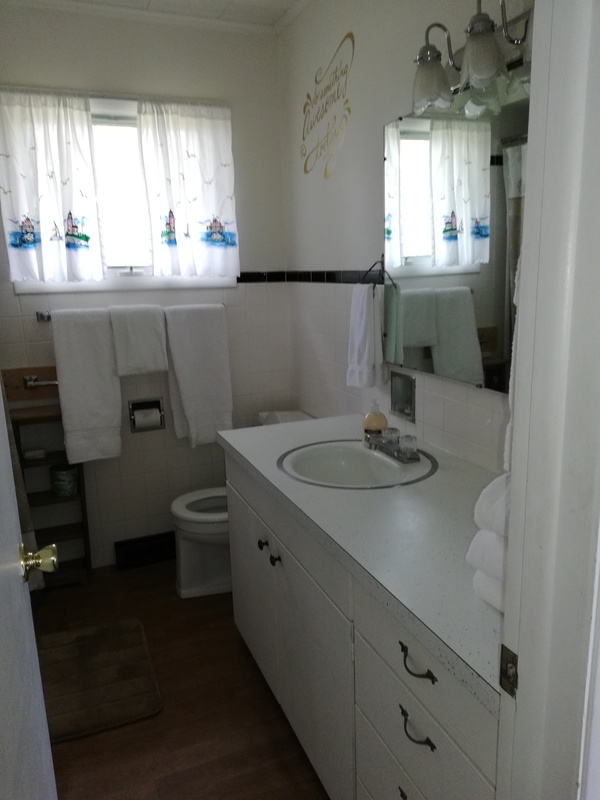
Where is `bathroom counter top`? Image resolution: width=600 pixels, height=800 pixels. bathroom counter top is located at coordinates (408, 542).